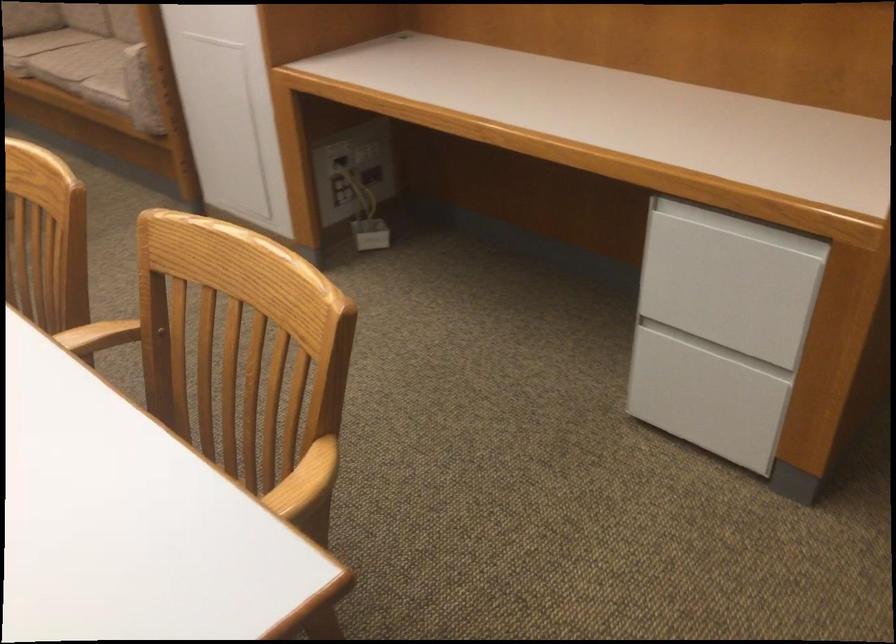
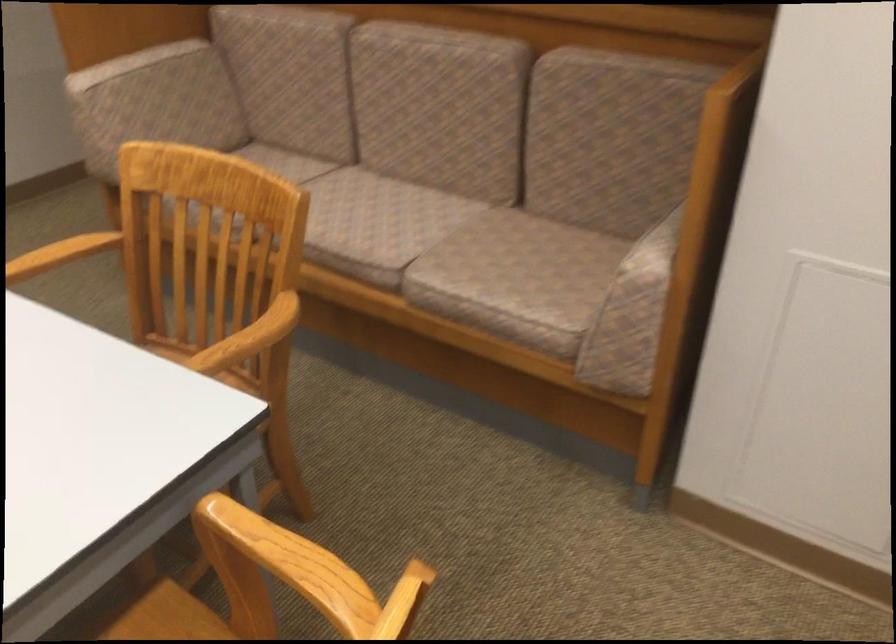
The images are taken continuously from a first-person perspective. In which direction are you moving?

The cameraman moved toward left, forward.